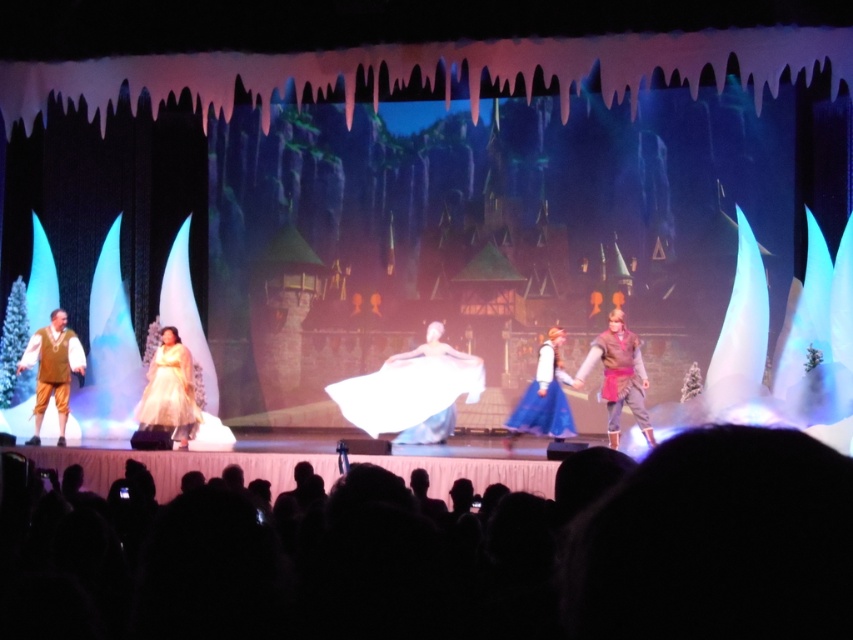
You are a stagehand responsible for moving a 3.5 meter long ladder from the left side of the stage to the center. The ladder must be placed between the brown leather pants at left and the white satin dress at center. Is there enough space for the ladder to fit without overlapping either performer?

The distance between the brown leather pants at left and the white satin dress at center is 4.22 meters. Since the ladder is 3.5 meters long, there is sufficient space to place it between them without overlapping either performer.

You are a stagehand who needs to place a decorative snowflake exactly at the point marked as point (619, 376). What object will the snowflake be placed on?

The point (619, 376) corresponds to the brown leather vest at center, so the snowflake will be placed on the brown leather vest at center.